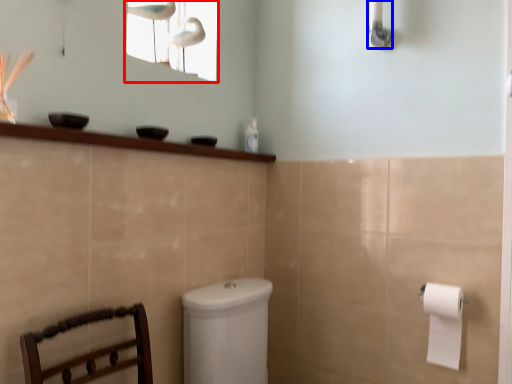
Question: Which object appears farthest to the camera in this image, window screen (highlighted by a red box) or shower (highlighted by a blue box)?

Choices:
 (A) window screen
 (B) shower

Answer: (A)